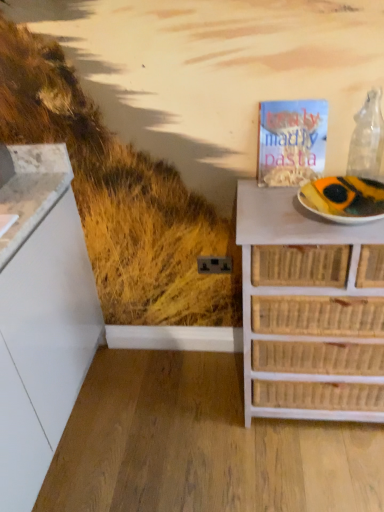
In order to face matte paper magazine at upper right, should I rotate leftwards or rightwards?

Rotate your view right by about 13.314°.

What do you see at coordinates (291, 141) in the screenshot?
I see `matte paper magazine at upper right` at bounding box center [291, 141].

What do you see at coordinates (367, 138) in the screenshot? This screenshot has height=512, width=384. I see `transparent glass wine bottle at upper right` at bounding box center [367, 138].

The width and height of the screenshot is (384, 512). I want to click on white paper plate at right, so click(x=336, y=214).

Describe the element at coordinates (309, 312) in the screenshot. I see `white wicker chest of drawers at right` at that location.

The height and width of the screenshot is (512, 384). In order to click on matte paper magazine at upper right in this screenshot , I will do (291, 141).

Based on the photo, considering the sizes of objects white wicker chest of drawers at right and transparent glass wine bottle at upper right in the image provided, who is wider, white wicker chest of drawers at right or transparent glass wine bottle at upper right?

Wider between the two is white wicker chest of drawers at right.

Is white wicker chest of drawers at right to the left of transparent glass wine bottle at upper right from the viewer's perspective?

Correct, you'll find white wicker chest of drawers at right to the left of transparent glass wine bottle at upper right.

Is white wicker chest of drawers at right inside or outside of transparent glass wine bottle at upper right?

white wicker chest of drawers at right is spatially situated outside transparent glass wine bottle at upper right.

Who is taller, white wicker chest of drawers at right or transparent glass wine bottle at upper right?

white wicker chest of drawers at right is taller.

This screenshot has height=512, width=384. I want to click on magazine that appears above the white wicker chest of drawers at right (from the image's perspective), so click(x=291, y=141).

Considering the relative sizes of white wicker chest of drawers at right and matte paper magazine at upper right in the image provided, is white wicker chest of drawers at right wider than matte paper magazine at upper right?

Yes, white wicker chest of drawers at right is wider than matte paper magazine at upper right.

Is white wicker chest of drawers at right placed right next to matte paper magazine at upper right?

No, white wicker chest of drawers at right is not next to matte paper magazine at upper right.

Is matte paper magazine at upper right not near white paper plate at right?

Actually, matte paper magazine at upper right and white paper plate at right are a little close together.

Does matte paper magazine at upper right have a greater width compared to white paper plate at right?

In fact, matte paper magazine at upper right might be narrower than white paper plate at right.

How many degrees apart are the facing directions of matte paper magazine at upper right and white paper plate at right?

2.25 degrees separate the facing orientations of matte paper magazine at upper right and white paper plate at right.

In the scene shown: From their relative heights in the image, would you say matte paper magazine at upper right is taller or shorter than white paper plate at right?

In the image, matte paper magazine at upper right appears to be taller than white paper plate at right.

Which object is positioned more to the right, white paper plate at right or transparent glass wine bottle at upper right?

transparent glass wine bottle at upper right.

Does white paper plate at right have a lesser height compared to transparent glass wine bottle at upper right?

Yes.

Considering the points (301, 201) and (360, 162), which point is behind, point (301, 201) or point (360, 162)?

Point (360, 162)

Do you think white paper plate at right is within transparent glass wine bottle at upper right, or outside of it?

white paper plate at right is not inside transparent glass wine bottle at upper right, it's outside.

Is transparent glass wine bottle at upper right bigger than white paper plate at right?

No.

Is transparent glass wine bottle at upper right facing away from white paper plate at right?

transparent glass wine bottle at upper right is not turned away from white paper plate at right.

Is transparent glass wine bottle at upper right positioned behind white paper plate at right?

Yes, transparent glass wine bottle at upper right is further from the viewer.

Is transparent glass wine bottle at upper right with white paper plate at right?

No, transparent glass wine bottle at upper right is not with white paper plate at right.

Between matte paper magazine at upper right and white wicker chest of drawers at right, which one has less height?

Standing shorter between the two is matte paper magazine at upper right.

Is matte paper magazine at upper right oriented away from white wicker chest of drawers at right?

matte paper magazine at upper right does not have its back to white wicker chest of drawers at right.

Is matte paper magazine at upper right positioned far away from white wicker chest of drawers at right?

No.

From the image's perspective, between matte paper magazine at upper right and white wicker chest of drawers at right, which one is located above?

matte paper magazine at upper right, from the image's perspective.

Who is bigger, transparent glass wine bottle at upper right or white wicker chest of drawers at right?

With larger size is white wicker chest of drawers at right.

Between transparent glass wine bottle at upper right and white wicker chest of drawers at right, which one has more height?

Standing taller between the two is white wicker chest of drawers at right.

The height and width of the screenshot is (512, 384). In the image, there is a transparent glass wine bottle at upper right. Identify the location of the chest of drawers below it (from the image's perspective). (309, 312).

Based on the photo, which is more distant, (380, 164) or (280, 275)?

The point (380, 164) is behind.

Where is `the chest of drawers below the transparent glass wine bottle at upper right (from a real-world perspective)`? the chest of drawers below the transparent glass wine bottle at upper right (from a real-world perspective) is located at coordinates (309, 312).

Identify the location of magazine above the white wicker chest of drawers at right (from a real-world perspective). The image size is (384, 512). (291, 141).

Looking at the image, which one is located closer to white paper plate at right, transparent glass wine bottle at upper right or white wicker chest of drawers at right?

The object closer to white paper plate at right is white wicker chest of drawers at right.

Based on their spatial positions, is transparent glass wine bottle at upper right or matte paper magazine at upper right closer to white wicker chest of drawers at right?

matte paper magazine at upper right is positioned closer to the anchor white wicker chest of drawers at right.

When comparing their distances from white paper plate at right, does transparent glass wine bottle at upper right or matte paper magazine at upper right seem closer?

matte paper magazine at upper right lies closer to white paper plate at right than the other object.

Looking at the image, which one is located closer to white paper plate at right, white wicker chest of drawers at right or transparent glass wine bottle at upper right?

The object closer to white paper plate at right is white wicker chest of drawers at right.

Based on their spatial positions, is white wicker chest of drawers at right or white paper plate at right closer to transparent glass wine bottle at upper right?

white paper plate at right lies closer to transparent glass wine bottle at upper right than the other object.

Considering their positions, is white paper plate at right positioned further to matte paper magazine at upper right than transparent glass wine bottle at upper right?

white paper plate at right.

Considering their positions, is matte paper magazine at upper right positioned further to transparent glass wine bottle at upper right than white wicker chest of drawers at right?

Among the two, white wicker chest of drawers at right is located further to transparent glass wine bottle at upper right.

Considering their positions, is transparent glass wine bottle at upper right positioned further to white wicker chest of drawers at right than white paper plate at right?

Based on the image, transparent glass wine bottle at upper right appears to be further to white wicker chest of drawers at right.

This screenshot has height=512, width=384. What are the coordinates of `magazine between transparent glass wine bottle at upper right and white paper plate at right vertically` in the screenshot? It's located at (291, 141).

In order to click on paper plate between matte paper magazine at upper right and white wicker chest of drawers at right in the up-down direction in this screenshot , I will do `click(336, 214)`.

Where is `paper plate between transparent glass wine bottle at upper right and white wicker chest of drawers at right from top to bottom`? The width and height of the screenshot is (384, 512). paper plate between transparent glass wine bottle at upper right and white wicker chest of drawers at right from top to bottom is located at coordinates (336, 214).

Locate an element on the screen. The width and height of the screenshot is (384, 512). magazine between transparent glass wine bottle at upper right and white wicker chest of drawers at right in the up-down direction is located at coordinates (291, 141).